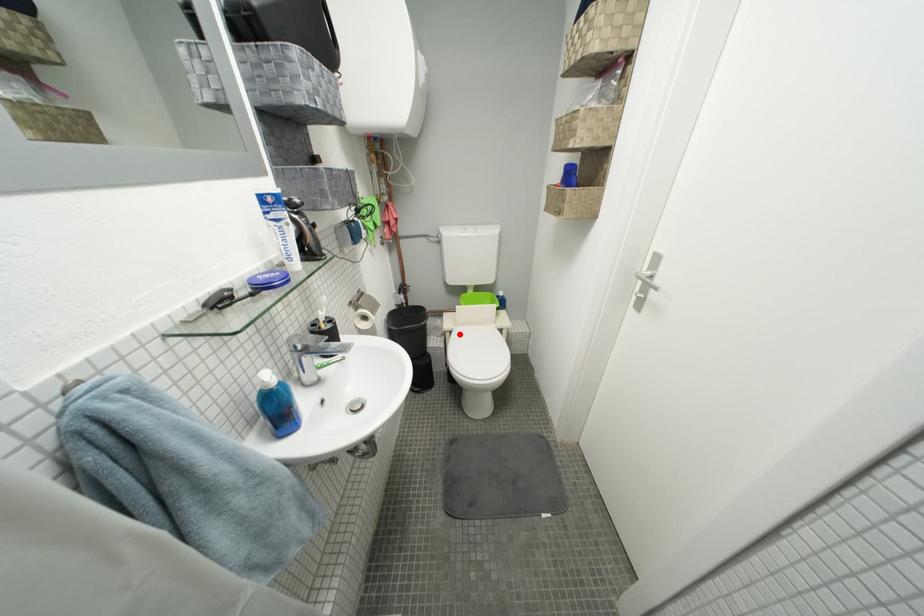
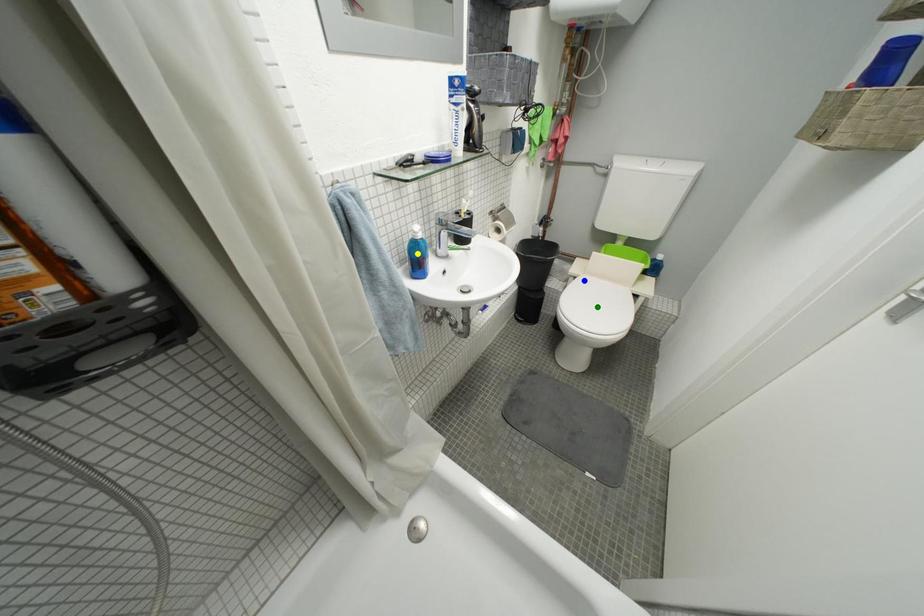
Question: I am providing you with two images of the same scene from different viewpoints. A red point is marked on the first image. You are given multiple points on the second image. Which mark in image 2 goes with the point in image 1?

Choices:
 (A) green point
 (B) blue point
 (C) yellow point

Answer: (B)